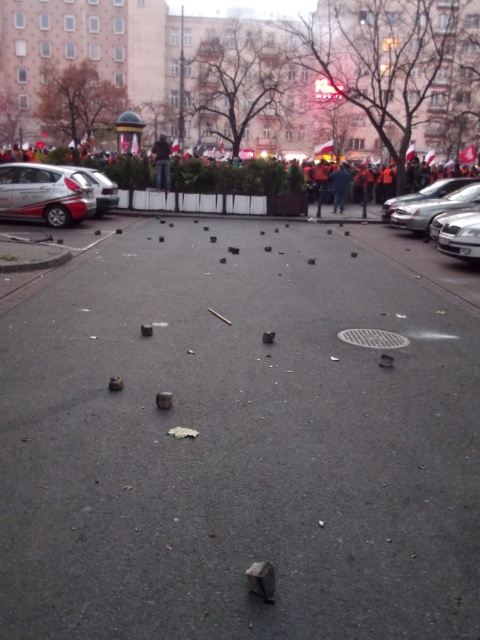
Question: Does silver metallic hatchback at left appear on the right side of dark gray jacket at center?

Choices:
 (A) yes
 (B) no

Answer: (B)

Question: Based on their relative distances, which object is farther from the silver metallic car at left?

Choices:
 (A) silver metallic sedan at right
 (B) dark gray jacket at center
 (C) metallic silver car at right
 (D) silver metallic hatchback at left

Answer: (A)

Question: Which object is positioned closest to the dark blue jacket at center?

Choices:
 (A) dark gray jacket at center
 (B) silver metallic hatchback at left
 (C) silver metallic sedan at right
 (D) silver metallic car at left

Answer: (A)

Question: Can you confirm if silver metallic hatchback at left is smaller than silver metallic sedan at right?

Choices:
 (A) yes
 (B) no

Answer: (B)

Question: Which of these objects is positioned closest to the dark blue jacket at center?

Choices:
 (A) metallic silver car at right
 (B) silver metallic sedan at right

Answer: (A)

Question: Can you confirm if silver metallic car at left is wider than dark gray jacket at center?

Choices:
 (A) no
 (B) yes

Answer: (A)